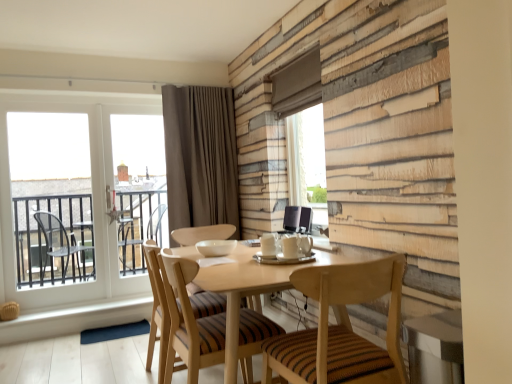
I want to click on vacant region below white glass window at left (from a real-world perspective), so click(94, 302).